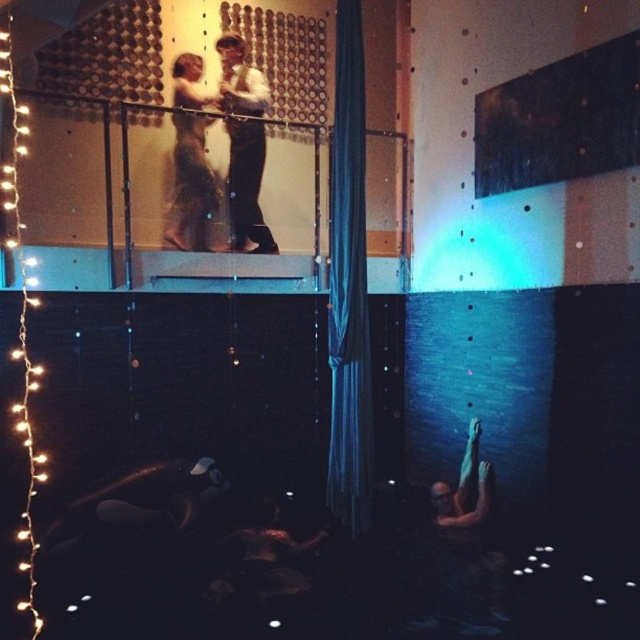
You are a stagehand preparing to adjust the lighting for the performance. You need to ensure that the white shirt at upper center is illuminated properly. Given the blue silky curtain at center is blocking some of the light, which object should you move to the left to allow more light to reach the white shirt?

You should move the blue silky curtain at center to the left since it is currently positioned on the right side of the white shirt at upper center, blocking the light. Moving it left would clear the path for better illumination.

You are standing on the stage and want to move from one spot to another. There are two points marked on the floor for your performance. The first point is at coordinate point (353, 472) and the second is at point (252, 236). Which point is closer to you as you stand on the stage?

Point (353, 472) is closer to the viewer than point (252, 236), so the first point is closer to you.

You are an event planner setting up for a formal dance. You need to ensure the smooth skin man at lower right has enough space to move freely. Considering the blue silky curtain at center, which is larger in size, will it block his path?

The blue silky curtain at center is larger in size than the smooth skin man at lower right. Since the curtain is bigger, it may block his path depending on its placement. However, the description does not specify the curtain position relative to the man, so it is unclear if it directly obstructs his movement. Further details about their arrangement are needed to determine this.